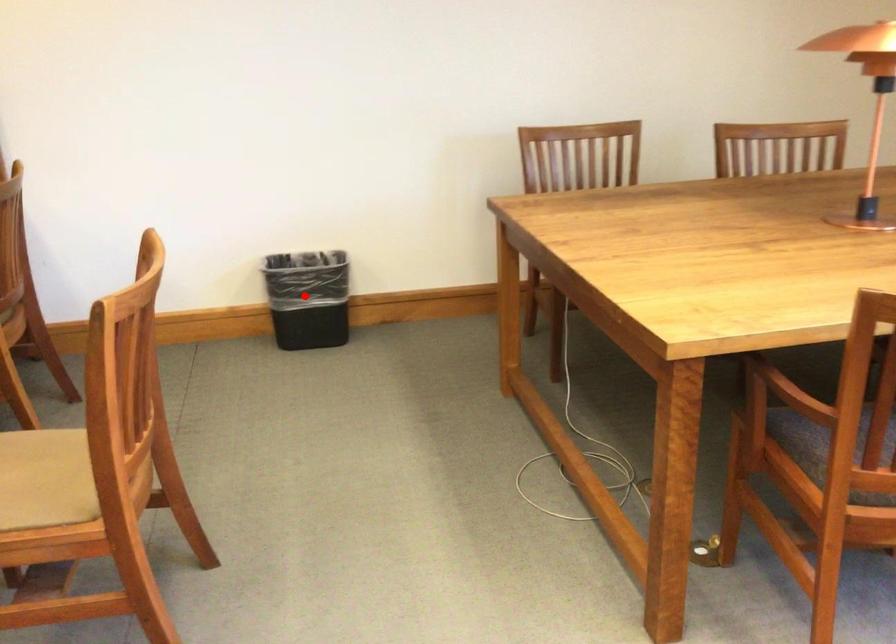
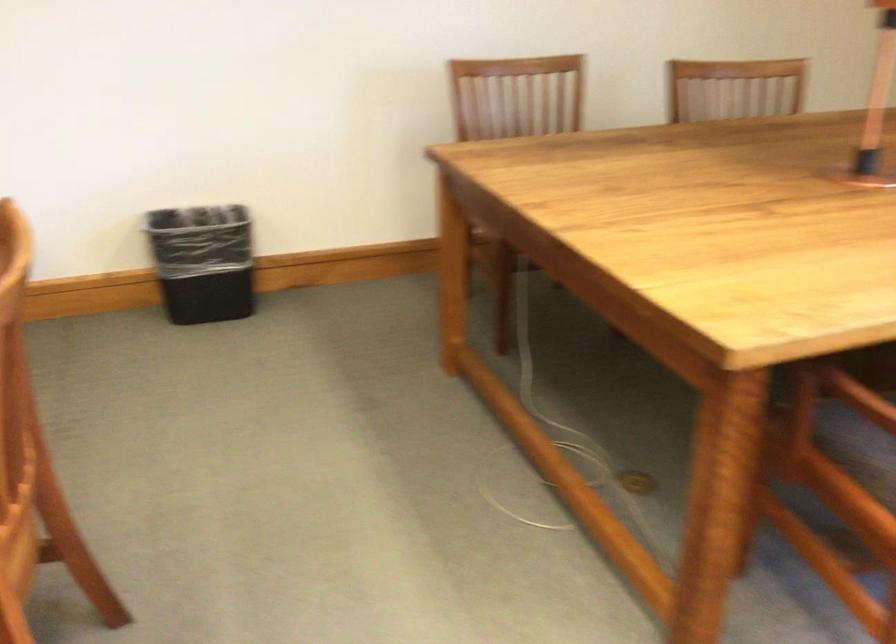
Question: I am providing you with two images of the same scene from different viewpoints. In image1, a red point is highlighted. Considering the same 3D point in image2, which of the following is correct?

Choices:
 (A) It is closer
 (B) It is farther

Answer: (A)